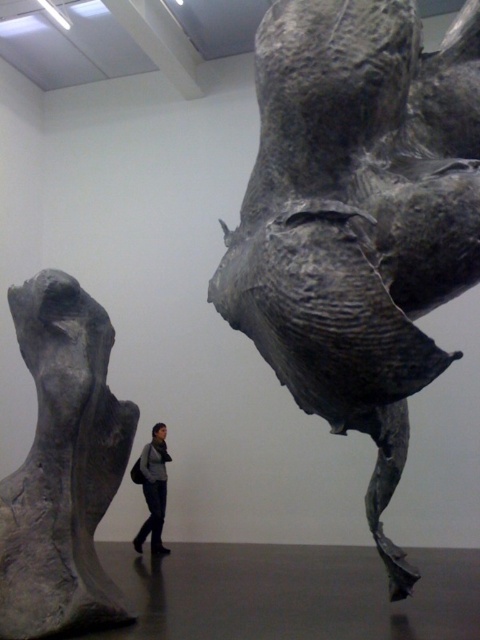
You are an art curator planning to install a new spotlight in the gallery. The spotlight needs to be placed at point [358,218]. Which sculpture should the spotlight illuminate?

The point [358,218] marks the gray textured sculpture at upper right, so the spotlight should illuminate the gray textured sculpture at upper right.

You are an art curator planning to rearrange the sculptures in the gallery. You want to move the gray textured sculpture at upper right to the left side of the dark gray fabric jacket at center. Is this possible without overlapping them?

The gray textured sculpture at upper right is currently positioned on the right side of the dark gray fabric jacket at center. Moving it to the left side would require space, but since the jacket is at the center, there is space available. This rearrangement is possible without overlapping them.

You are an art curator planning to install a new spotlight that requires a 1.2 meter clearance from the floor. Given the positions of the gray textured sculpture at upper right and the gray matte sculpture at left, which sculpture will the spotlight illuminate if placed at the correct height?

The gray textured sculpture at upper right will be illuminated because it is located above the gray matte sculpture at left, placing it within the spotlight range if positioned correctly.